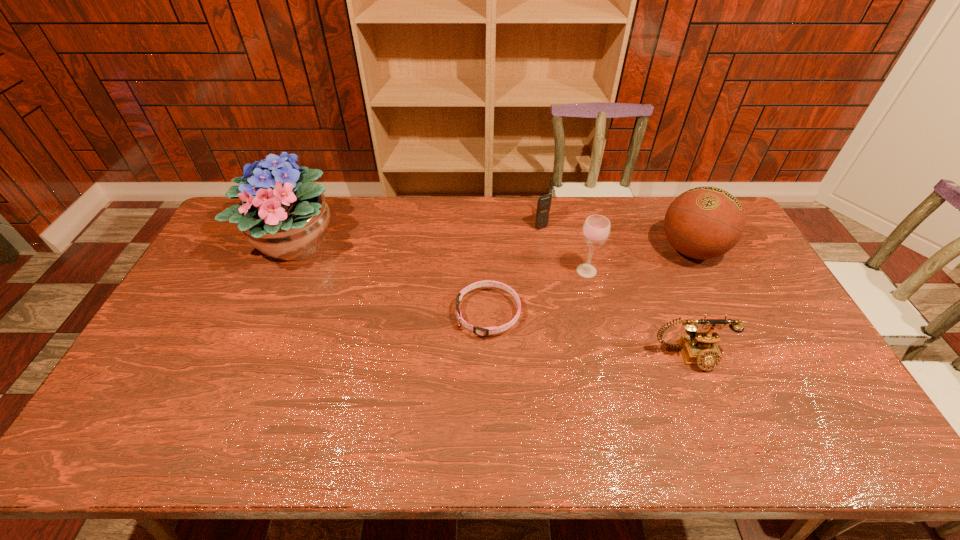
You are a GUI agent. You are given a task and a screenshot of the screen. Output one action in this format:
    pyautogui.click(x=<x>, y=<y>)
    Task: Click on the basketball at the far edge
    
    Given the screenshot: What is the action you would take?
    pyautogui.click(x=705, y=222)

You are a GUI agent. You are given a task and a screenshot of the screen. Output one action in this format:
    pyautogui.click(x=<x>, y=<y>)
    Task: Click on the cellular telephone positioned at the far edge
    
    Given the screenshot: What is the action you would take?
    pyautogui.click(x=544, y=202)

I want to click on object present at the left edge, so (282, 214).

The width and height of the screenshot is (960, 540). What are the coordinates of `object present at the right edge` in the screenshot? It's located at (705, 222).

Find the location of a particular element. The image size is (960, 540). object at the far left corner is located at coordinates (282, 214).

Where is `object at the far right corner`? object at the far right corner is located at coordinates (705, 222).

Where is `free space at the far edge of the desktop`? This screenshot has height=540, width=960. free space at the far edge of the desktop is located at coordinates (595, 210).

In the image, there is a desktop. Where is `free space at the left edge`? The width and height of the screenshot is (960, 540). free space at the left edge is located at coordinates (250, 253).

At what (x,y) coordinates should I click in order to perform the action: click on free space at the right edge of the desktop. Please return your answer as a coordinate pair (x, y). The image size is (960, 540). Looking at the image, I should click on (780, 319).

Locate an element on the screen. This screenshot has width=960, height=540. free point between the wineglass and the telephone is located at coordinates (638, 314).